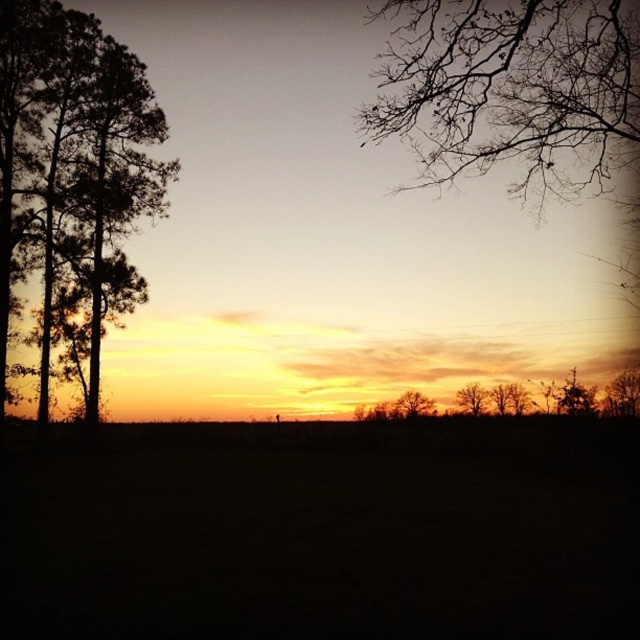
Question: In this image, where is dark grass at center located relative to bare branches at upper right?

Choices:
 (A) left
 (B) right

Answer: (A)

Question: Which object is positioned farthest from the silhouette bare trees at center?

Choices:
 (A) brown textured tree at right
 (B) bare branches at upper right

Answer: (B)

Question: Can you confirm if brown textured tree at right is positioned above silhouette bare tree at center?

Choices:
 (A) yes
 (B) no

Answer: (A)

Question: Among these points, which one is nearest to the camera?

Choices:
 (A) pyautogui.click(x=605, y=412)
 (B) pyautogui.click(x=396, y=90)
 (C) pyautogui.click(x=86, y=61)
 (D) pyautogui.click(x=484, y=401)

Answer: (B)

Question: Which object is the farthest from the dark green foliage at left?

Choices:
 (A) dark grass at center
 (B) brown textured tree at right
 (C) silhouette bare trees at center
 (D) bare branches at upper right

Answer: (B)

Question: Can you confirm if dark grass at center is positioned to the right of silhouette bare tree at center?

Choices:
 (A) yes
 (B) no

Answer: (B)